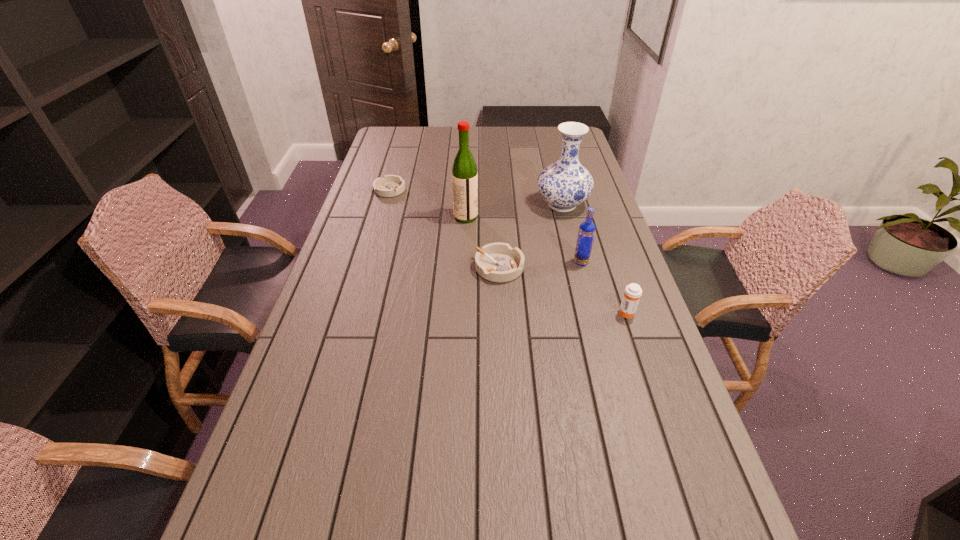
Find the location of a particular element. Image resolution: width=960 pixels, height=540 pixels. the farther ashtray is located at coordinates (390, 185).

Where is `the leftmost object`? The image size is (960, 540). the leftmost object is located at coordinates tap(390, 185).

Image resolution: width=960 pixels, height=540 pixels. I want to click on the right ashtray, so click(x=498, y=262).

Where is `the second shortest object`? Image resolution: width=960 pixels, height=540 pixels. the second shortest object is located at coordinates (498, 262).

Where is `the second tallest object`? Image resolution: width=960 pixels, height=540 pixels. the second tallest object is located at coordinates (566, 183).

Identify the location of vodka. The height and width of the screenshot is (540, 960). (586, 233).

Where is `liquor`? Image resolution: width=960 pixels, height=540 pixels. liquor is located at coordinates (464, 169).

I want to click on the third shortest object, so click(x=632, y=293).

Find the location of a particular element. Image resolution: width=960 pixels, height=540 pixels. medicine is located at coordinates (632, 293).

Locate an element on the screen. vacant area situated 0.260m on the front of the leftmost object is located at coordinates 375,240.